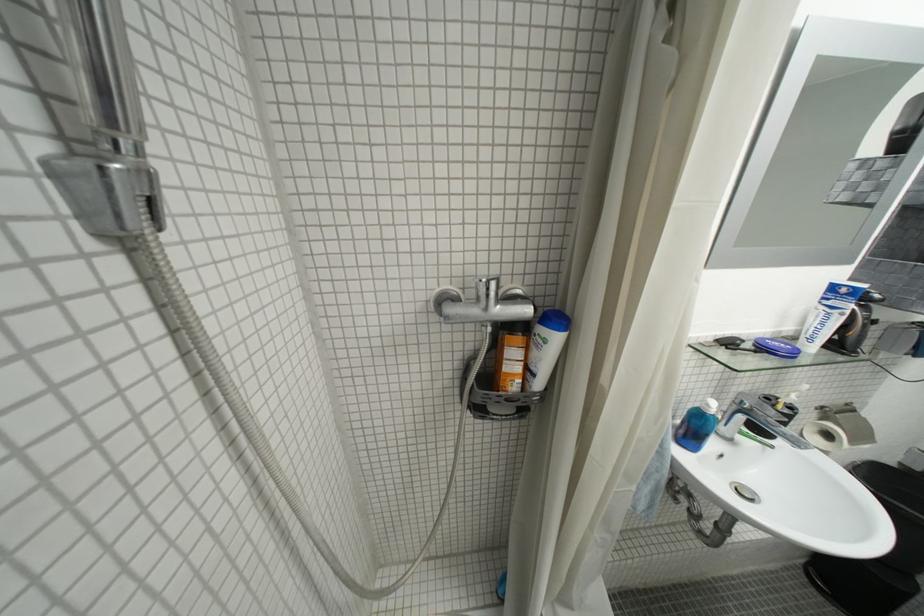
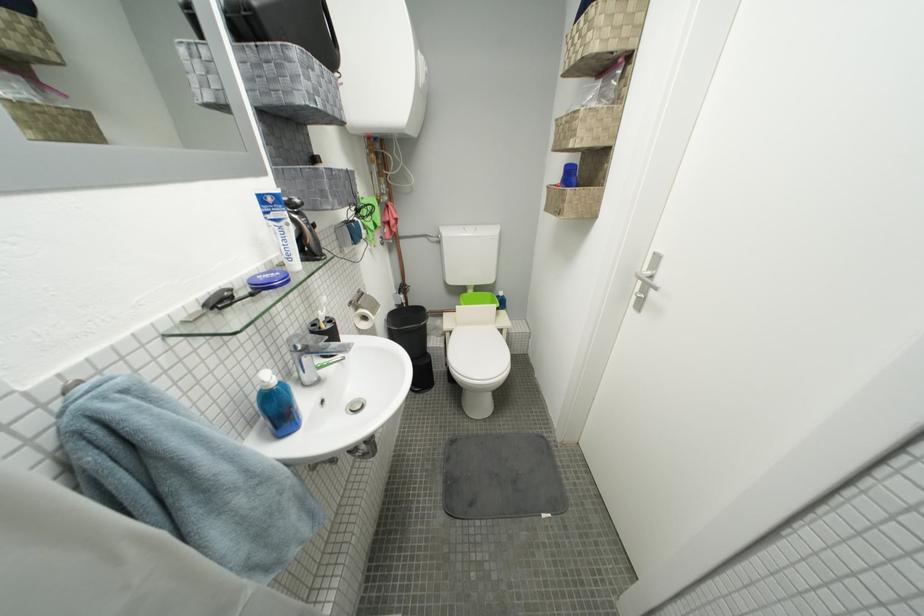
The first image is from the beginning of the video and the second image is from the end. How did the camera likely rotate when shooting the video?

The rotation direction of the camera is right-down.